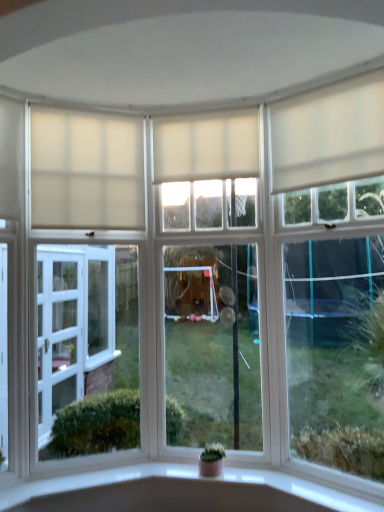
At what (x,y) coordinates should I click in order to perform the action: click on free spot above white matte curtain at center, which ranks as the 2th curtain in left-to-right order (from a real-world perspective). Please return your answer as a coordinate pair (x, y). The width and height of the screenshot is (384, 512). Looking at the image, I should click on (206, 104).